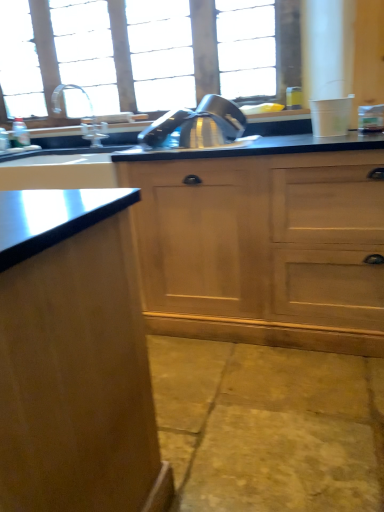
The width and height of the screenshot is (384, 512). I want to click on satin nickel faucet at upper left, so click(83, 118).

At what (x,y) coordinates should I click in order to perform the action: click on clear glass window at upper center. Please return your answer as a coordinate pair (x, y). This screenshot has height=512, width=384. Looking at the image, I should click on (149, 52).

The image size is (384, 512). What do you see at coordinates (149, 52) in the screenshot?
I see `clear glass window at upper center` at bounding box center [149, 52].

What is the approximate height of yellow stone concrete at lower center?

It is 1.95 inches.

The height and width of the screenshot is (512, 384). What are the coordinates of `wooden cabinet at center` in the screenshot? It's located at (263, 248).

Which is more to the left, wooden cabinet at center or satin nickel faucet at upper left?

From the viewer's perspective, satin nickel faucet at upper left appears more on the left side.

Is wooden cabinet at center spatially inside satin nickel faucet at upper left, or outside of it?

wooden cabinet at center is not inside satin nickel faucet at upper left, it's outside.

Locate an element on the screen. This screenshot has width=384, height=512. tap on the left of wooden cabinet at center is located at coordinates (83, 118).

Is wooden cabinet at center looking in the opposite direction of satin nickel faucet at upper left?

No, wooden cabinet at center is not facing the opposite direction of satin nickel faucet at upper left.

What are the coordinates of `concrete that appears in front of the wooden cabinet at center` in the screenshot? It's located at (268, 426).

Looking at this image, can you confirm if wooden cabinet at center is bigger than yellow stone concrete at lower center?

Indeed, wooden cabinet at center has a larger size compared to yellow stone concrete at lower center.

Is wooden cabinet at center taller than yellow stone concrete at lower center?

Yes.

Is clear glass window at upper center oriented away from satin nickel faucet at upper left?

That's not correct — clear glass window at upper center is not looking away from satin nickel faucet at upper left.

Consider the image. From the image's perspective, between clear glass window at upper center and satin nickel faucet at upper left, who is located below?

satin nickel faucet at upper left is shown below in the image.

Looking at the image, does clear glass window at upper center seem bigger or smaller compared to satin nickel faucet at upper left?

In the image, clear glass window at upper center appears to be larger than satin nickel faucet at upper left.

Considering the points (25, 8) and (104, 137), which point is behind, point (25, 8) or point (104, 137)?

Positioned behind is point (25, 8).

Is clear glass window at upper center spatially inside yellow stone concrete at lower center, or outside of it?

clear glass window at upper center is outside yellow stone concrete at lower center.

Considering the positions of point (228, 23) and point (263, 415), is point (228, 23) closer or farther from the camera than point (263, 415)?

Point (228, 23).

Is clear glass window at upper center to the right of yellow stone concrete at lower center from the viewer's perspective?

No.

Which of these two, clear glass window at upper center or wooden cabinet at center, stands shorter?

clear glass window at upper center is shorter.

From the image's perspective, who appears lower, clear glass window at upper center or wooden cabinet at center?

wooden cabinet at center.

Does clear glass window at upper center lie in front of wooden cabinet at center?

No, clear glass window at upper center is further to the viewer.

Which of these two, clear glass window at upper center or wooden cabinet at center, is smaller?

With smaller size is clear glass window at upper center.

From the image's perspective, would you say satin nickel faucet at upper left is shown under yellow stone concrete at lower center?

Actually, satin nickel faucet at upper left appears above yellow stone concrete at lower center in the image.

Considering the sizes of objects satin nickel faucet at upper left and yellow stone concrete at lower center in the image provided, who is shorter, satin nickel faucet at upper left or yellow stone concrete at lower center?

Standing shorter between the two is yellow stone concrete at lower center.

Between satin nickel faucet at upper left and yellow stone concrete at lower center, which one has smaller size?

Smaller between the two is satin nickel faucet at upper left.

Who is more distant, satin nickel faucet at upper left or yellow stone concrete at lower center?

Positioned behind is satin nickel faucet at upper left.

Does point (298, 356) appear closer or farther from the camera than point (99, 21)?

Point (298, 356).

From a real-world perspective, relative to clear glass window at upper center, is yellow stone concrete at lower center vertically above or below?

From a real-world perspective, yellow stone concrete at lower center is physically below clear glass window at upper center.

From the picture: Considering the relative positions of yellow stone concrete at lower center and clear glass window at upper center in the image provided, is yellow stone concrete at lower center to the left or to the right of clear glass window at upper center?

In the image, yellow stone concrete at lower center appears on the right side of clear glass window at upper center.

Locate an element on the screen. This screenshot has height=512, width=384. window behind the yellow stone concrete at lower center is located at coordinates (149, 52).

The image size is (384, 512). I want to click on tap on the left of wooden cabinet at center, so click(x=83, y=118).

At what (x,y) coordinates should I click in order to perform the action: click on dresser above the yellow stone concrete at lower center (from the image's perspective). Please return your answer as a coordinate pair (x, y). The height and width of the screenshot is (512, 384). Looking at the image, I should click on (x=263, y=248).

Which object lies nearer to the anchor point satin nickel faucet at upper left, yellow stone concrete at lower center or wooden cabinet at center?

wooden cabinet at center is positioned closer to the anchor satin nickel faucet at upper left.

Estimate the real-world distances between objects in this image. Which object is closer to clear glass window at upper center, wooden cabinet at center or satin nickel faucet at upper left?

The object closer to clear glass window at upper center is satin nickel faucet at upper left.

Estimate the real-world distances between objects in this image. Which object is closer to wooden cabinet at center, clear glass window at upper center or satin nickel faucet at upper left?

satin nickel faucet at upper left.

Which object lies nearer to the anchor point wooden cabinet at center, yellow stone concrete at lower center or satin nickel faucet at upper left?

The object closer to wooden cabinet at center is yellow stone concrete at lower center.

Based on their spatial positions, is yellow stone concrete at lower center or clear glass window at upper center closer to satin nickel faucet at upper left?

Among the two, clear glass window at upper center is located nearer to satin nickel faucet at upper left.

Which object lies nearer to the anchor point clear glass window at upper center, yellow stone concrete at lower center or wooden cabinet at center?

wooden cabinet at center lies closer to clear glass window at upper center than the other object.

From the image, which object appears to be farther from clear glass window at upper center, wooden cabinet at center or yellow stone concrete at lower center?

yellow stone concrete at lower center.

Estimate the real-world distances between objects in this image. Which object is further from yellow stone concrete at lower center, clear glass window at upper center or satin nickel faucet at upper left?

clear glass window at upper center is positioned further to the anchor yellow stone concrete at lower center.

Where is `tap between clear glass window at upper center and yellow stone concrete at lower center in the up-down direction`? Image resolution: width=384 pixels, height=512 pixels. tap between clear glass window at upper center and yellow stone concrete at lower center in the up-down direction is located at coordinates (83, 118).

Where is `dresser between satin nickel faucet at upper left and yellow stone concrete at lower center from top to bottom`? The height and width of the screenshot is (512, 384). dresser between satin nickel faucet at upper left and yellow stone concrete at lower center from top to bottom is located at coordinates (263, 248).

Find the location of a particular element. This screenshot has width=384, height=512. dresser that lies between clear glass window at upper center and yellow stone concrete at lower center from top to bottom is located at coordinates (263, 248).

Image resolution: width=384 pixels, height=512 pixels. In order to click on tap between clear glass window at upper center and wooden cabinet at center in the vertical direction in this screenshot , I will do `click(83, 118)`.